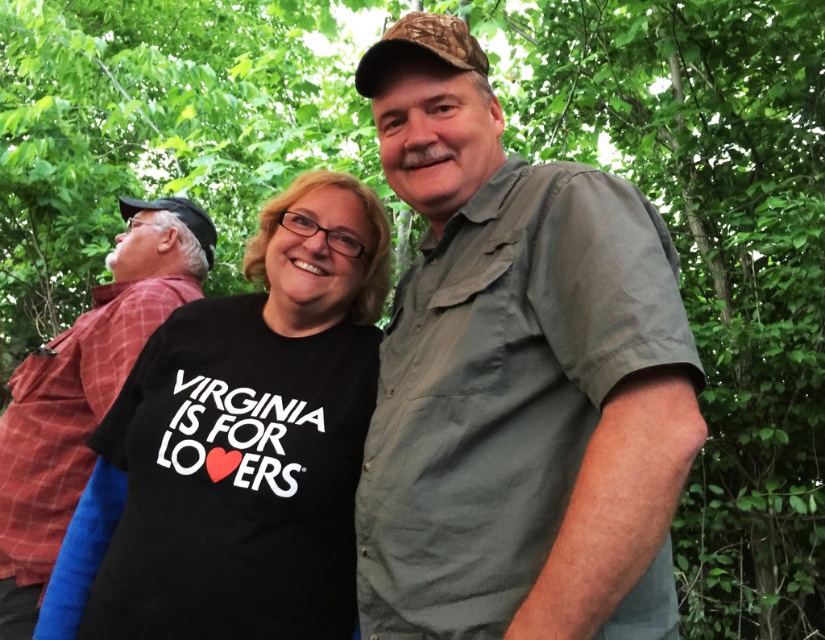
Which is below, matte gray shirt at center or red plaid shirt at left?

red plaid shirt at left is lower down.

Is point (530, 326) closer to viewer compared to point (130, 212)?

Yes, point (530, 326) is closer to viewer.

Find the location of a particular element. The width and height of the screenshot is (825, 640). matte gray shirt at center is located at coordinates (517, 378).

Is matte gray shirt at center to the left of black matte t-shirt at center from the viewer's perspective?

Incorrect, matte gray shirt at center is not on the left side of black matte t-shirt at center.

Who is more distant from viewer, (495, 161) or (159, 611)?

The point (495, 161) is more distant.

Is point (448, 134) positioned in front of point (277, 259)?

That is True.

You are a GUI agent. You are given a task and a screenshot of the screen. Output one action in this format:
    pyautogui.click(x=<x>, y=<y>)
    Task: Click on the matte gray shirt at center
    This screenshot has height=640, width=825.
    Given the screenshot: What is the action you would take?
    coord(517,378)

Is black matte t-shirt at center below red plaid shirt at left?

Yes.

Can you confirm if black matte t-shirt at center is wider than red plaid shirt at left?

Correct, the width of black matte t-shirt at center exceeds that of red plaid shirt at left.

Who is more distant from viewer, (337, 451) or (177, 232)?

Point (177, 232)

You are a GUI agent. You are given a task and a screenshot of the screen. Output one action in this format:
    pyautogui.click(x=<x>, y=<y>)
    Task: Click on the black matte t-shirt at center
    This screenshot has height=640, width=825.
    Given the screenshot: What is the action you would take?
    pyautogui.click(x=250, y=436)